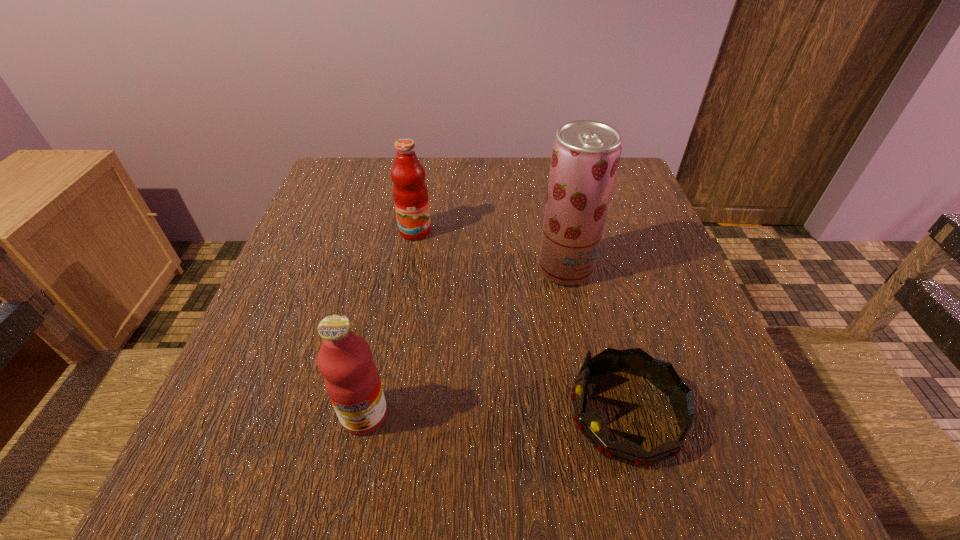
Point out which object is positioned as the second nearest to the tiara. Please provide its 2D coordinates. Your answer should be formatted as a tuple, i.e. [(x, y)], where the tuple contains the x and y coordinates of a point satisfying the conditions above.

[(351, 378)]

Identify which object is the closest to the farthest fruit juice. Please provide its 2D coordinates. Your answer should be formatted as a tuple, i.e. [(x, y)], where the tuple contains the x and y coordinates of a point satisfying the conditions above.

[(585, 156)]

Choose which fruit juice is the nearest neighbor to the second nearest fruit juice. Please provide its 2D coordinates. Your answer should be formatted as a tuple, i.e. [(x, y)], where the tuple contains the x and y coordinates of a point satisfying the conditions above.

[(410, 193)]

Where is `fruit juice identified as the second closest to the farthest object`? fruit juice identified as the second closest to the farthest object is located at coordinates (351, 378).

The image size is (960, 540). I want to click on free spot that satisfies the following two spatial constraints: 1. on the front label of the farthest object; 2. on the right side of the rightmost fruit juice, so click(x=409, y=269).

Locate an element on the screen. This screenshot has width=960, height=540. vacant area that satisfies the following two spatial constraints: 1. at the front of the tiara with jewels; 2. on the label of the nearest fruit juice is located at coordinates (626, 415).